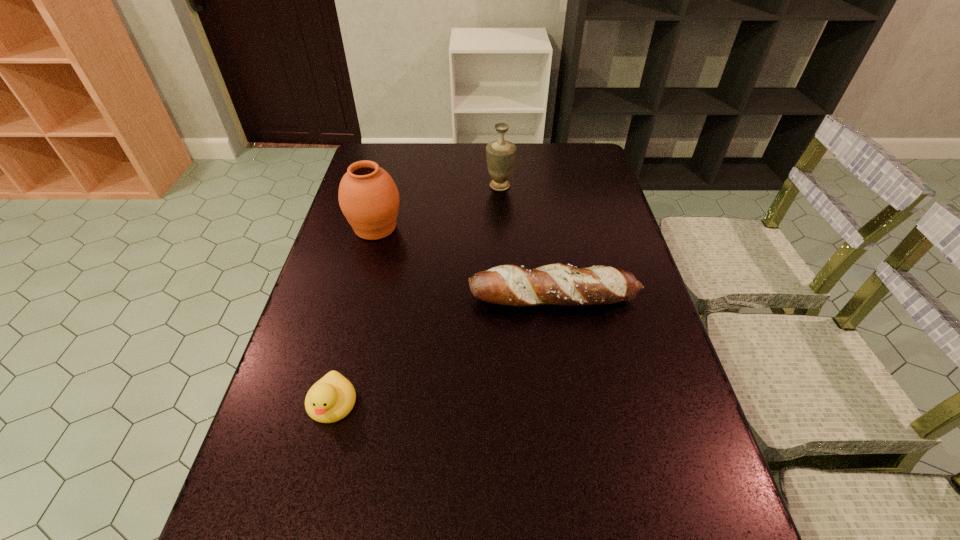
Image resolution: width=960 pixels, height=540 pixels. Find the location of `urn that is at the left edge`. urn that is at the left edge is located at coordinates (368, 196).

Where is `duckling present at the left edge`? The image size is (960, 540). duckling present at the left edge is located at coordinates point(330,399).

Locate an element on the screen. object that is at the right edge is located at coordinates (555, 284).

This screenshot has width=960, height=540. What are the coordinates of `vacant region at the far edge` in the screenshot? It's located at (458, 164).

I want to click on vacant space at the left edge, so click(x=341, y=246).

The width and height of the screenshot is (960, 540). In the image, there is a desktop. Identify the location of vacant space at the right edge. (564, 200).

In the image, there is a desktop. In order to click on vacant space at the far left corner in this screenshot , I will do `click(374, 144)`.

Locate an element on the screen. vacant space at the far right corner of the desktop is located at coordinates (596, 168).

Find the location of `vacant area that lies between the third nearest object and the farthest object`. vacant area that lies between the third nearest object and the farthest object is located at coordinates (438, 207).

Locate an element on the screen. vacant space in between the baguet and the left urn is located at coordinates (465, 262).